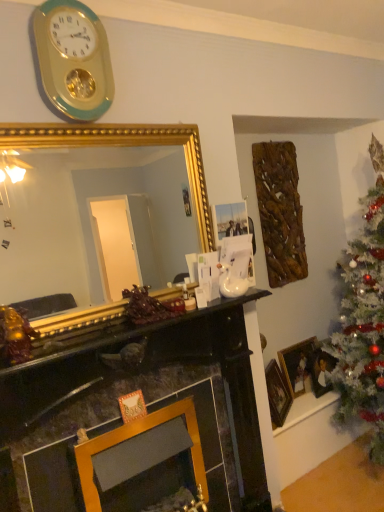
Question: Does gold/green plastic wall clock at upper left contain wooden picture frame at right, marked as the third picture frame in a front-to-back arrangement?

Choices:
 (A) yes
 (B) no

Answer: (B)

Question: Is the position of gold/green plastic wall clock at upper left more distant than that of wooden picture frame at right, marked as the third picture frame in a front-to-back arrangement?

Choices:
 (A) yes
 (B) no

Answer: (B)

Question: Is gold/green plastic wall clock at upper left shorter than wooden picture frame at right, the first picture frame viewed from the back?

Choices:
 (A) no
 (B) yes

Answer: (A)

Question: Considering the relative sizes of gold/green plastic wall clock at upper left and wooden picture frame at right, the first picture frame viewed from the back, in the image provided, is gold/green plastic wall clock at upper left wider than wooden picture frame at right, the first picture frame viewed from the back,?

Choices:
 (A) no
 (B) yes

Answer: (A)

Question: Is gold/green plastic wall clock at upper left facing away from wooden picture frame at right, the first picture frame viewed from the back?

Choices:
 (A) no
 (B) yes

Answer: (A)

Question: Is wooden picture frame at right, marked as the third picture frame in a front-to-back arrangement, bigger or smaller than gold/green plastic wall clock at upper left?

Choices:
 (A) big
 (B) small

Answer: (A)

Question: Is point (301, 355) positioned closer to the camera than point (69, 53)?

Choices:
 (A) closer
 (B) farther

Answer: (B)

Question: Would you say wooden picture frame at right, the first picture frame viewed from the back, is to the left or to the right of gold/green plastic wall clock at upper left in the picture?

Choices:
 (A) right
 (B) left

Answer: (A)

Question: Is wooden picture frame at right, the first picture frame viewed from the back, wider or thinner than gold/green plastic wall clock at upper left?

Choices:
 (A) wide
 (B) thin

Answer: (A)

Question: Does point (344, 420) appear closer or farther from the camera than point (44, 35)?

Choices:
 (A) closer
 (B) farther

Answer: (B)

Question: From the image's perspective, is white matte christmas tree at right located above or below gold/green plastic wall clock at upper left?

Choices:
 (A) below
 (B) above

Answer: (A)

Question: Is white matte christmas tree at right bigger or smaller than gold/green plastic wall clock at upper left?

Choices:
 (A) small
 (B) big

Answer: (B)

Question: Is white matte christmas tree at right in front of or behind gold/green plastic wall clock at upper left in the image?

Choices:
 (A) behind
 (B) front

Answer: (A)

Question: Is gold-framed picture at right, which appears as the 3th picture frame when viewed from the back, situated inside wooden picture frame at lower right, which ranks as the 2th picture frame in back-to-front order, or outside?

Choices:
 (A) inside
 (B) outside

Answer: (B)

Question: Is gold-framed picture at right, the first picture frame from the front, taller or shorter than wooden picture frame at lower right, which ranks as the 2th picture frame in back-to-front order?

Choices:
 (A) short
 (B) tall

Answer: (B)